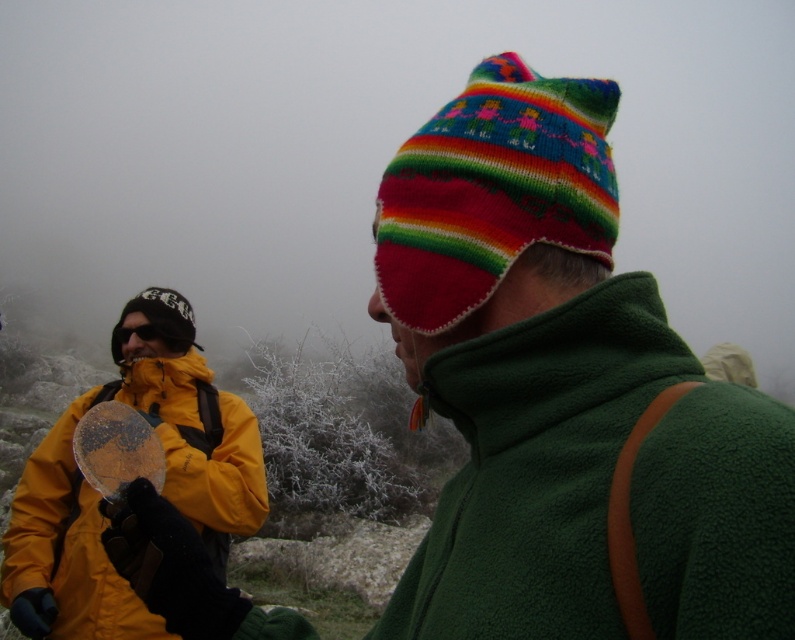
Does green fleece jacket at right appear over yellow fleece jacket at left?

Correct, green fleece jacket at right is located above yellow fleece jacket at left.

Is point (588, 481) farther from viewer compared to point (146, 358)?

No.

Identify the location of green fleece jacket at right. (600, 484).